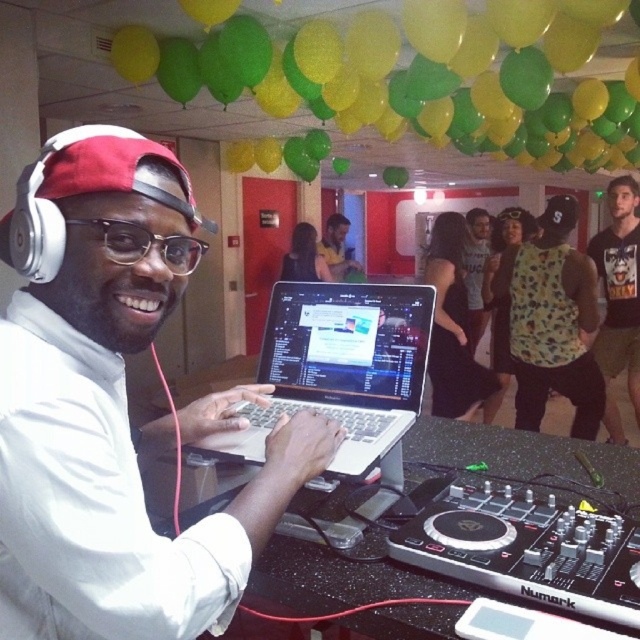
Question: Estimate the real-world distances between objects in this image. Which object is closer to the green matte balloon at upper center?

Choices:
 (A) white matte headphones at upper left
 (B) matte black laptop at center
 (C) floral-patterned tank top at center
 (D) dark gray t-shirt at center

Answer: (C)

Question: Is the position of dark gray t-shirt at center less distant than that of black plastic glasses at center?

Choices:
 (A) yes
 (B) no

Answer: (B)

Question: Estimate the real-world distances between objects in this image. Which object is closer to the dark gray t-shirt at center?

Choices:
 (A) floral-patterned tank top at center
 (B) green matte balloon at upper center
 (C) black plastic glasses at center
 (D) silver metallic laptop at center

Answer: (A)

Question: Is floral-patterned tank top at center wider than dark gray t-shirt at center?

Choices:
 (A) yes
 (B) no

Answer: (B)

Question: Does white matte headphones at upper left have a smaller size compared to matte black laptop at center?

Choices:
 (A) no
 (B) yes

Answer: (B)

Question: Based on their relative distances, which object is nearer to the silver metallic laptop at center?

Choices:
 (A) white matte headphones at upper left
 (B) matte black laptop at center
 (C) floral-patterned tank top at center
 (D) black plastic glasses at center

Answer: (A)